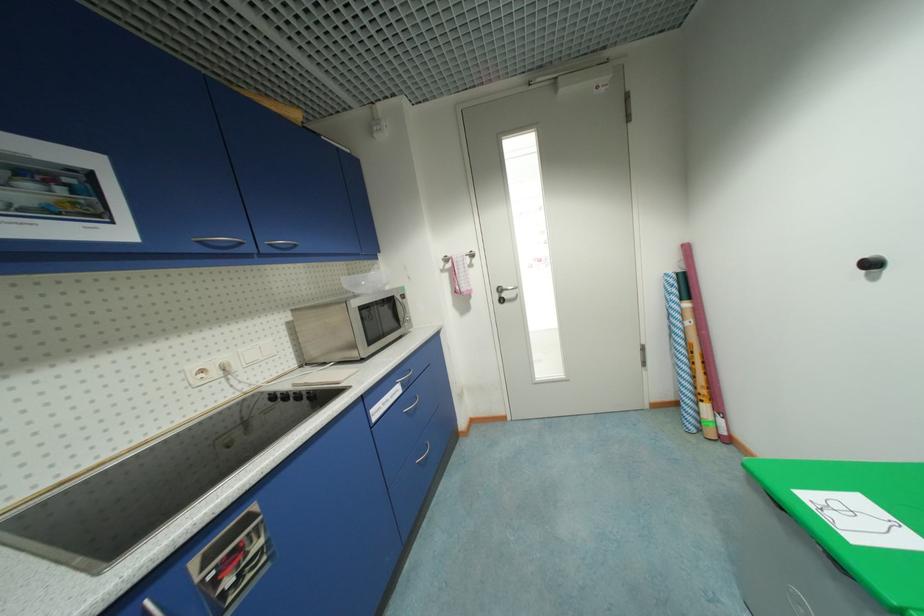
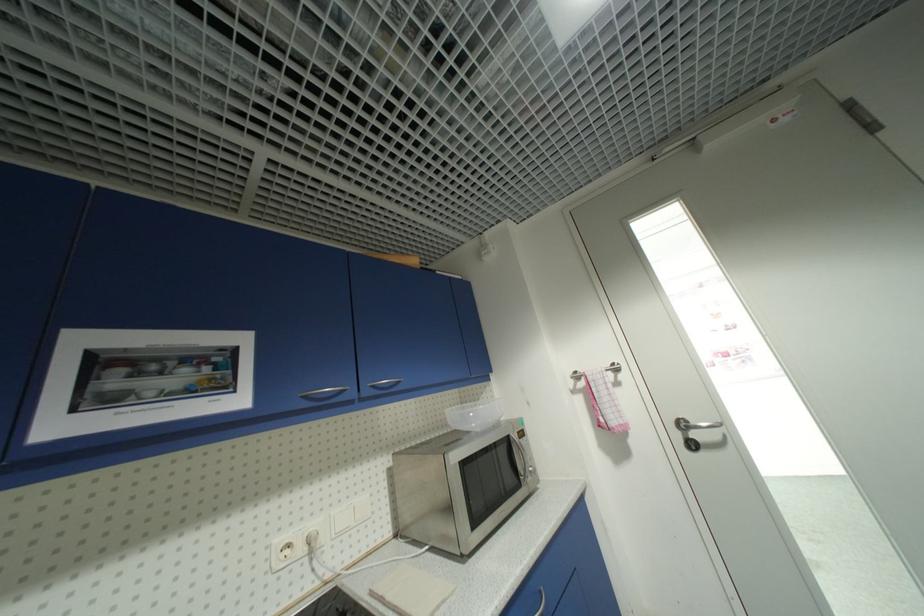
The point at (276, 246) is marked in the first image. Where is the corresponding point in the second image?

(379, 387)